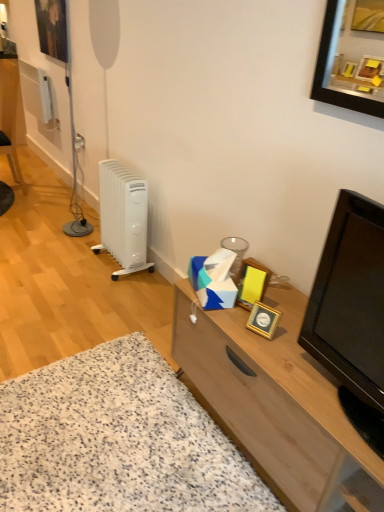
This screenshot has height=512, width=384. I want to click on vacant region to the left of white plastic radiator at left, so click(x=74, y=266).